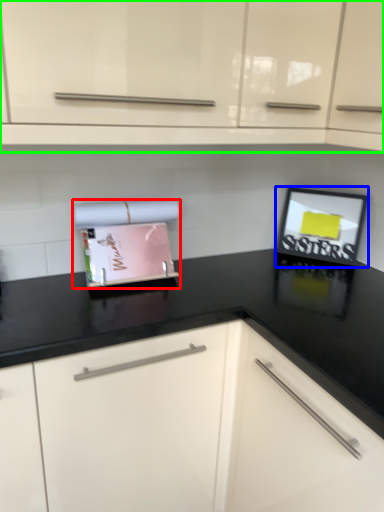
Question: Which object is positioned farthest from appliance (highlighted by a red box)? Select from picture frame (highlighted by a blue box) and cabinetry (highlighted by a green box).

Choices:
 (A) picture frame
 (B) cabinetry

Answer: (A)